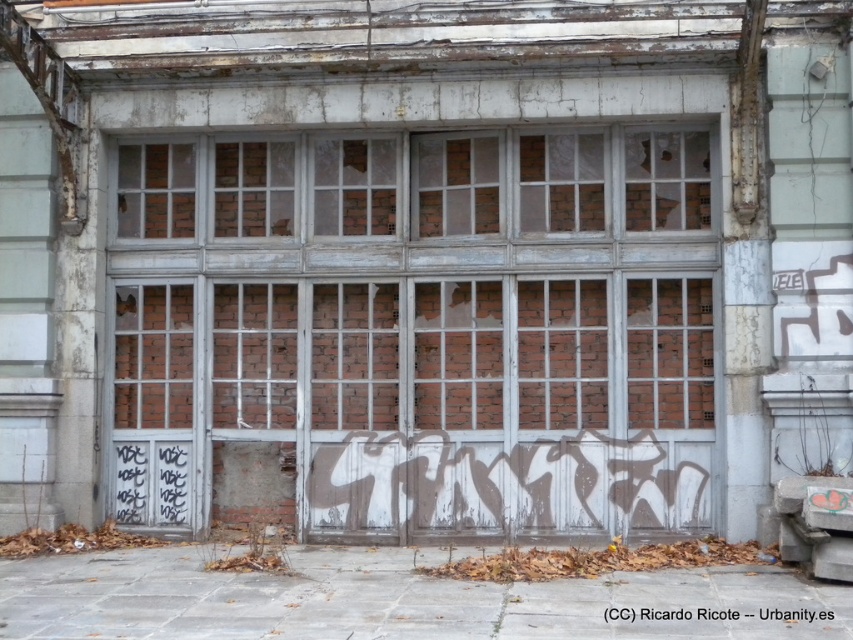
You are an inspector assessing the structural integrity of the old building. You notice two sections of the brick wall at center and brick wall at upper center. Which section has a higher risk of collapse due to its height?

The brick wall at center has a greater height compared to brick wall at upper center, so it has a higher risk of collapse due to its height.

You are standing in front of the abandoned building and notice the brick textured window at upper left and the white graffiti at center. Which object is positioned higher relative to the other?

The brick textured window at upper left is located above the white graffiti at center, so it is positioned higher.

You are standing in front of the abandoned building and want to take a photo of the brick wall at center. Based on its coordinates, where should you position yourself to capture it in the frame?

The brick wall at center is located at point coordinates (354,186), so you should position yourself directly in front of it to capture it in the frame.